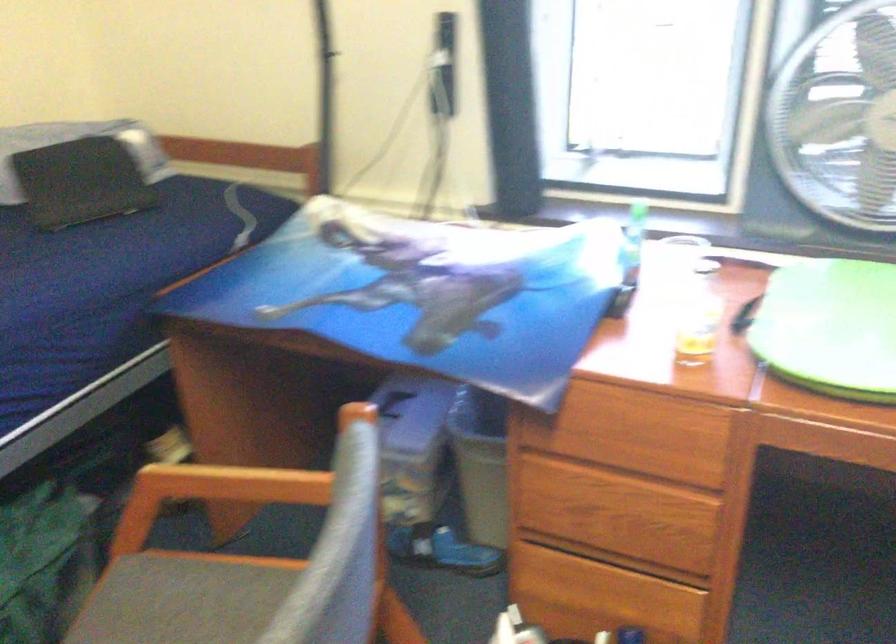
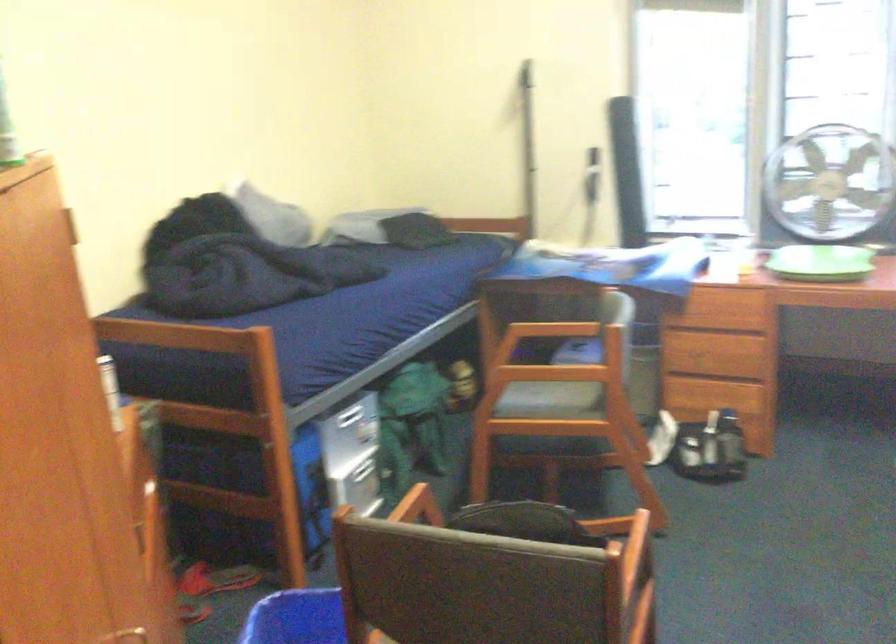
Question: The images are taken continuously from a first-person perspective. In which direction are you moving?

Choices:
 (A) Left
 (B) Right
 (C) Forward
 (D) Backward

Answer: (D)